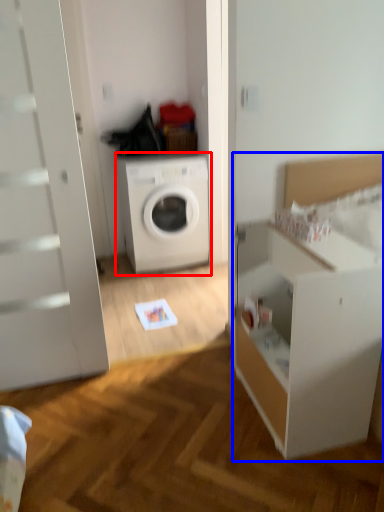
Question: Which point is closer to the camera, washing machine (highlighted by a red box) or dresser (highlighted by a blue box)?

Choices:
 (A) washing machine
 (B) dresser

Answer: (B)